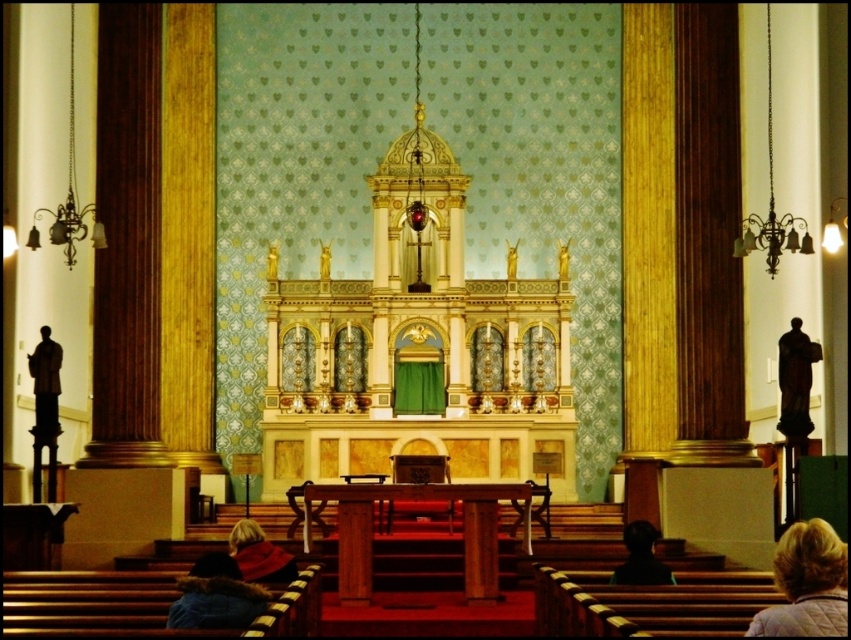
You are a photographer standing at the center of the church. You need to take a photo that includes both the blonde hair at lower right and the brown fur coat at lower left. Given that your camera has a maximum zoom range of 10 meters, will you be able to capture both objects in a single frame without moving your position?

The blonde hair at lower right and brown fur coat at lower left are 19.62 meters apart from each other. Since the camera can only zoom up to 10 meters, it won not be able to capture both objects in a single frame without moving your position.

You are a photographer setting up a shoot in this church. You need to place a 1.2 meter wide backdrop between the blonde hair at lower right and the brown fur coat at lower left. Will the backdrop fit between them?

The blonde hair at lower right is wider than the brown fur coat at lower left. However, the exact distance between them isn not specified in the provided information. Therefore, it is impossible to determine if the 1.2 meter wide backdrop will fit without additional spatial data about their separation.

You are standing at the entrance of the church and want to locate two specific points in the altar area. The first point is at coordinates point (781, 616) and the second is at point (204, 564). Based on the scene description, which point is closer to you?

Point (781, 616) is closer to you because it is in front of point (204, 564).